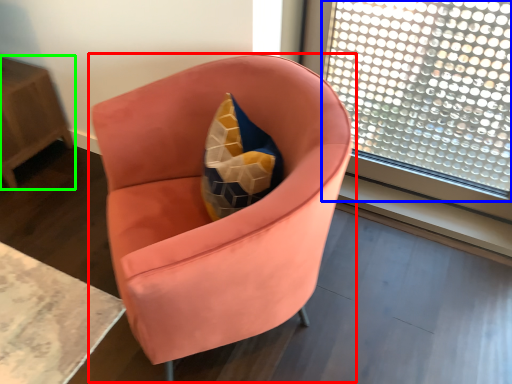
Question: Considering the real-world distances, which object is closest to chair (highlighted by a red box)? window (highlighted by a blue box) or table (highlighted by a green box).

Choices:
 (A) window
 (B) table

Answer: (A)